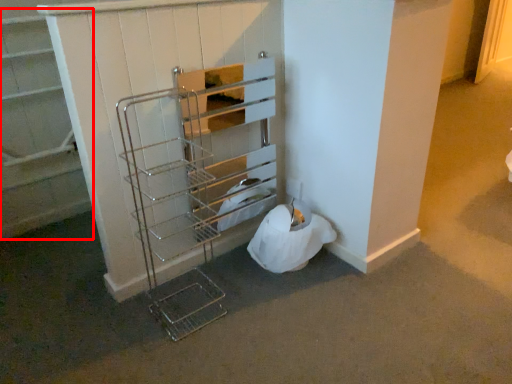
Question: Considering the relative positions of shelf (annotated by the red box) and shelf in the image provided, where is shelf (annotated by the red box) located with respect to the staircase?

Choices:
 (A) left
 (B) right

Answer: (A)